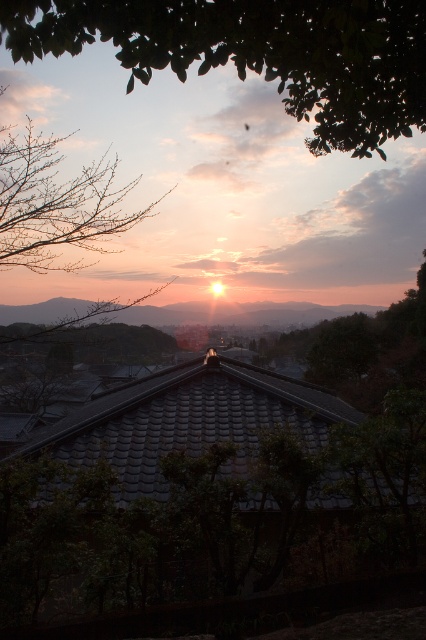
You are standing on a hill overlooking the sunset scene. You notice a green leafy tree at upper center and bare branches at upper left. Which object is closer to you, the observer?

The green leafy tree at upper center is closer to you because it is in front of the bare branches at upper left.

You are standing at the center of the image and want to locate the green leafy tree at upper center. According to the coordinates provided, in which direction should you look to find it?

The green leafy tree at upper center is located at coordinates point (258, 52), so you should look towards the upper center direction to find it.

You are an artist trying to paint the sunset scene. You notice the green leafy tree at upper center and the bare branches at upper left. Which object should you paint first if you want to follow the rule of painting taller objects before shorter ones?

You should paint the bare branches at upper left first because it is taller than the green leafy tree at upper center.